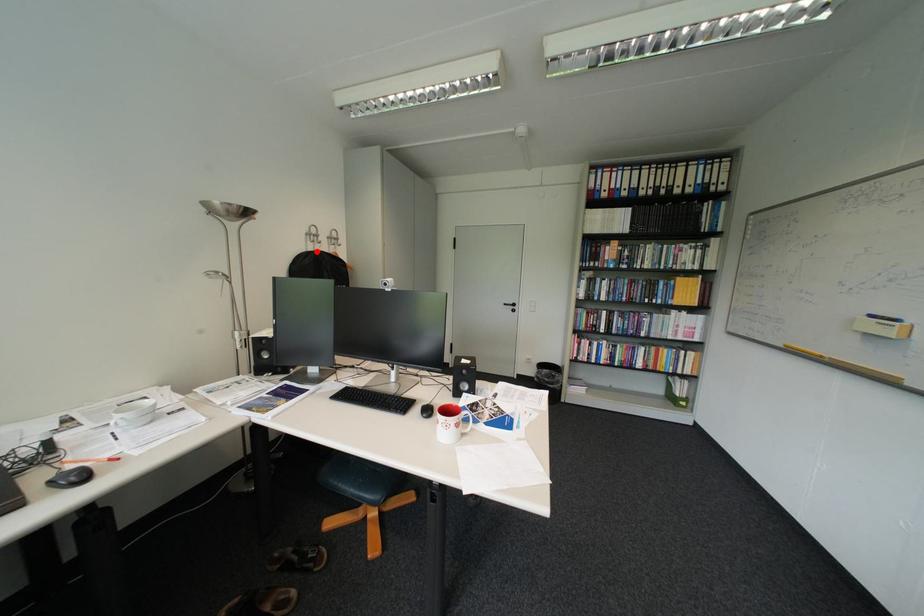
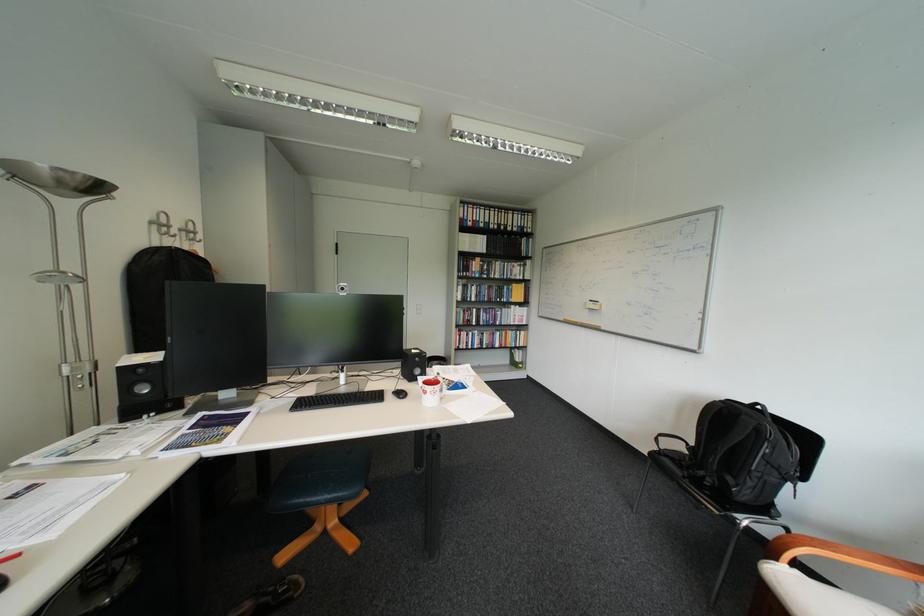
Locate, in the second image, the point that corresponds to the highlighted location in the first image.

(160, 246)